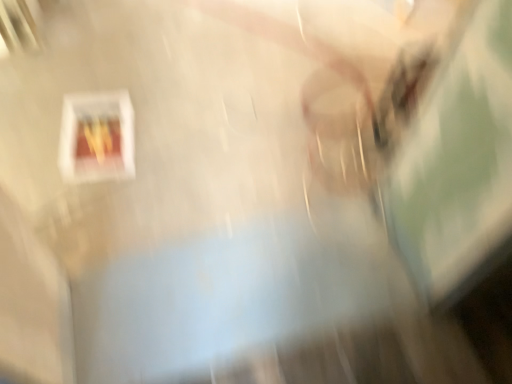
Locate an element on the screen. vacant space that is to the left of matte wooden picture frame at lower left is located at coordinates (49, 129).